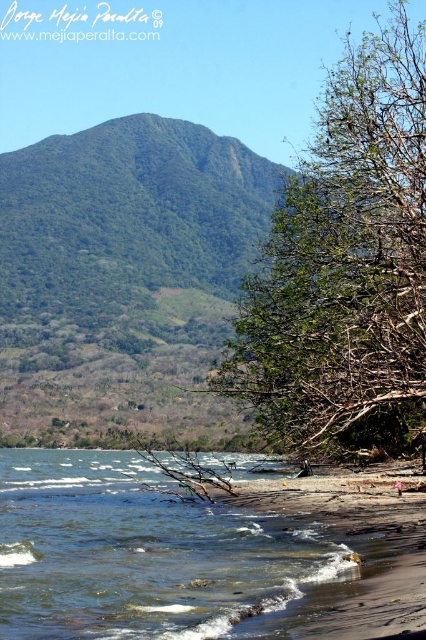
You are standing on the beach and want to walk from the clear water at lower left to the green leafy tree at center. Which direction should you head?

You should head to the right because the green leafy tree at center is to the right of the clear water at lower left.

You are standing at the center of the beach and want to reach the green leafy tree at center. Which direction should you walk to get there?

The green leafy tree at center is located at point coordinates, so you should walk towards the center of the beach to reach it.